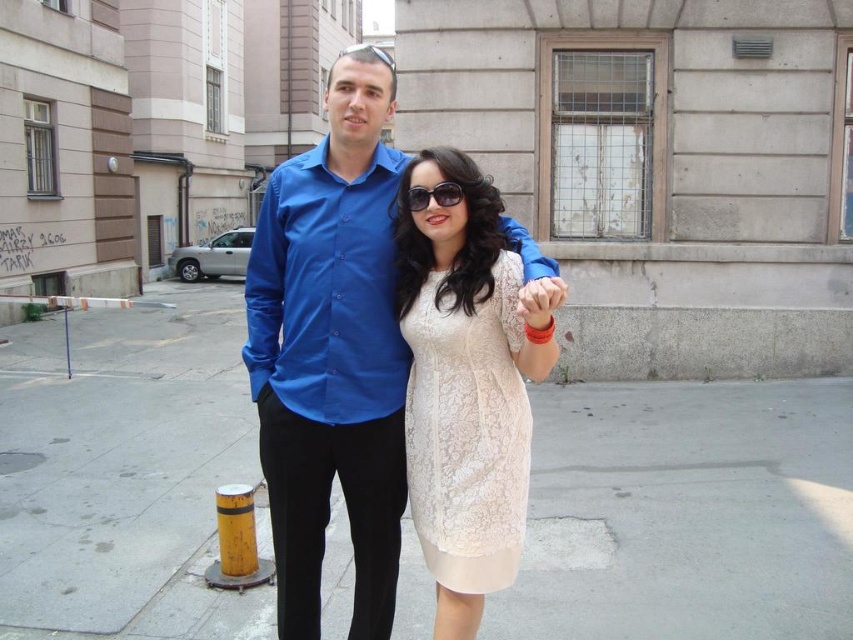
Consider the image. Can you confirm if gray concrete pavement at center is thinner than lace fabric dress at center?

No, gray concrete pavement at center is not thinner than lace fabric dress at center.

Based on the photo, is gray concrete pavement at center to the right of lace fabric dress at center from the viewer's perspective?

Incorrect, gray concrete pavement at center is not on the right side of lace fabric dress at center.

This screenshot has width=853, height=640. What do you see at coordinates (686, 513) in the screenshot?
I see `gray concrete pavement at center` at bounding box center [686, 513].

Identify the location of gray concrete pavement at center. Image resolution: width=853 pixels, height=640 pixels. (686, 513).

Between point (485, 554) and point (393, 65), which one is positioned behind?

The point (393, 65) is behind.

Is point (428, 419) positioned behind point (374, 48)?

No, it is not.

Measure the distance between point (422,330) and camera.

They are 7.99 feet apart.

This screenshot has width=853, height=640. In order to click on lace fabric dress at center in this screenshot , I will do `click(468, 433)`.

Image resolution: width=853 pixels, height=640 pixels. What do you see at coordinates (433, 195) in the screenshot? I see `sunglasses at center` at bounding box center [433, 195].

Does sunglasses at center appear under shiny black sunglasses at upper center?

Correct, sunglasses at center is located below shiny black sunglasses at upper center.

Between point (415, 204) and point (363, 48), which one is positioned in front?

Point (415, 204) is in front.

The height and width of the screenshot is (640, 853). What are the coordinates of `sunglasses at center` in the screenshot? It's located at (433, 195).